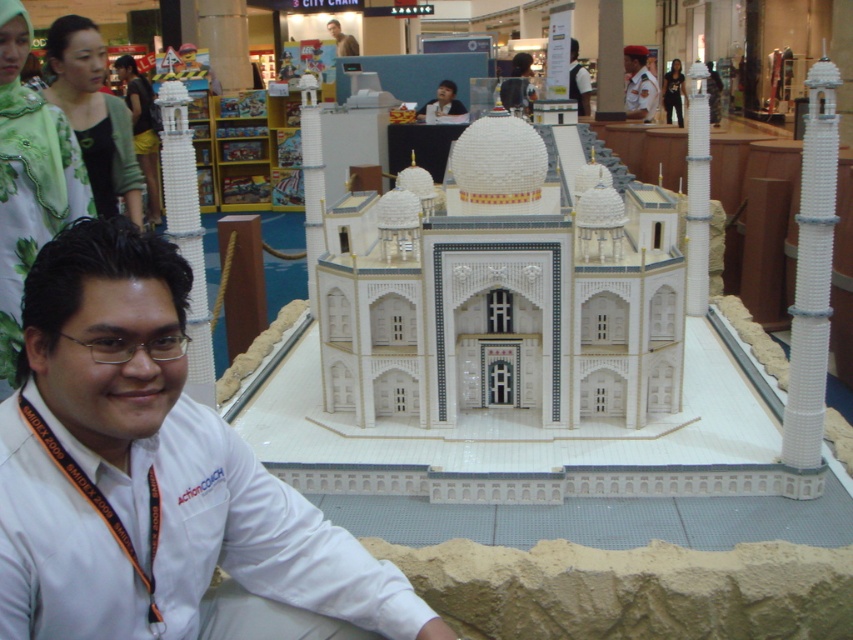
You are a photographer standing in front of the LEGO Taj Mahal model. You notice two people in the scene. One is wearing a matte green dress at upper left and the other is in a white uniform at center. Which person is positioned closer to you?

The matte green dress at upper left is closer to the viewer than the white uniform at center, so the person in the matte green dress at upper left is positioned closer to you.

You are a photographer taking a picture of the LEGO Taj Mahal model. You notice the green floral scarf at upper left and the white uniform at center. Which object should you focus on if you want to capture the smaller one in your shot?

The green floral scarf at upper left is smaller than the white uniform at center, so you should focus on the green floral scarf at upper left to capture the smaller one in your shot.